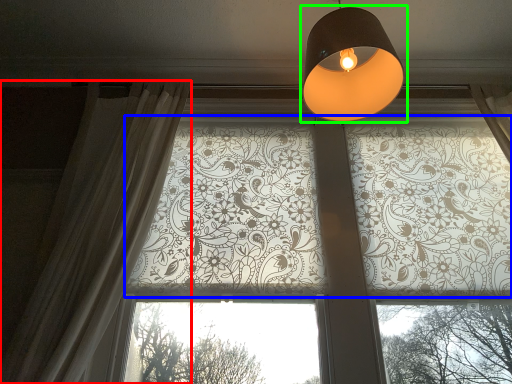
Question: Which object is positioned farthest from curtain (highlighted by a red box)? Select from bay window (highlighted by a blue box) and lamp (highlighted by a green box).

Choices:
 (A) bay window
 (B) lamp

Answer: (B)